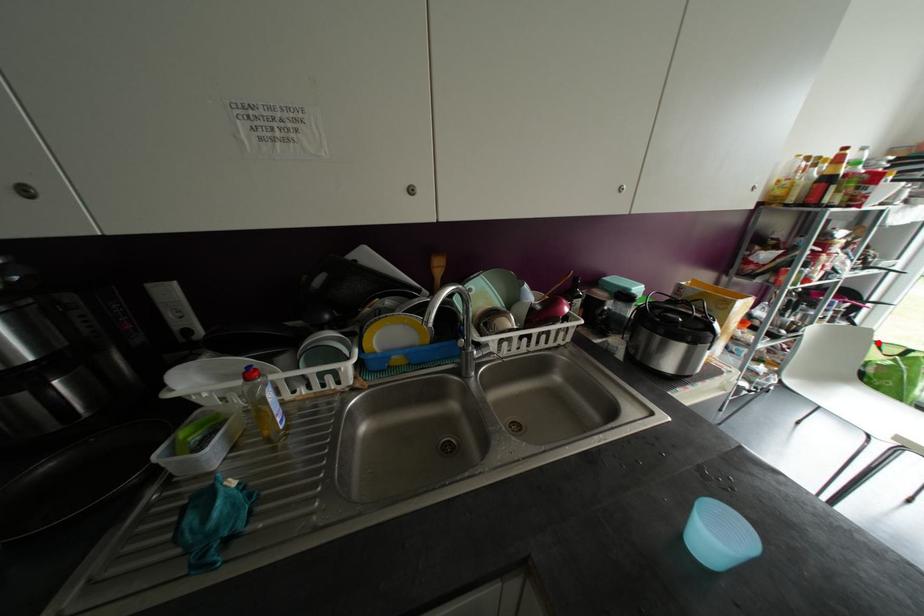
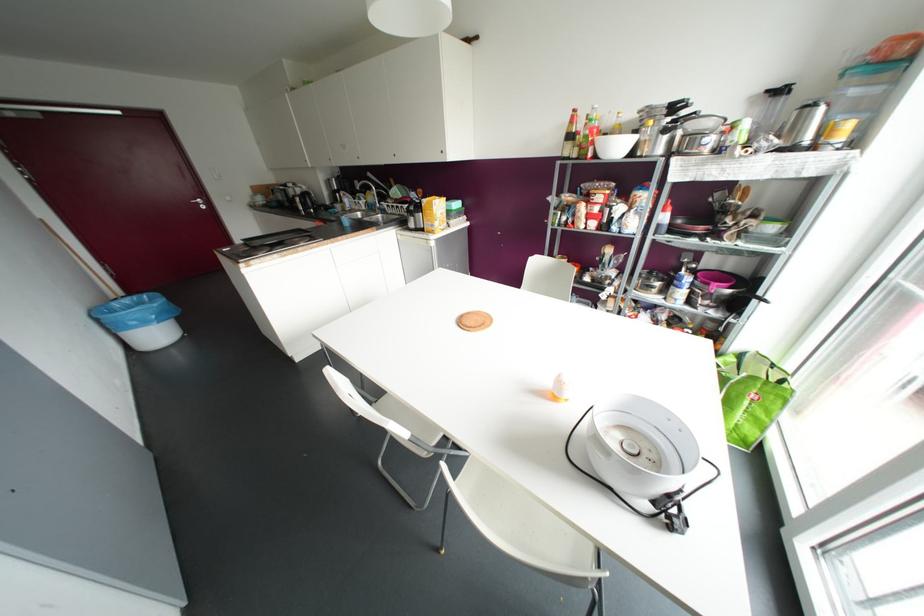
In the second image, find the point that corresponds to the highlighted location in the first image.

(772, 365)